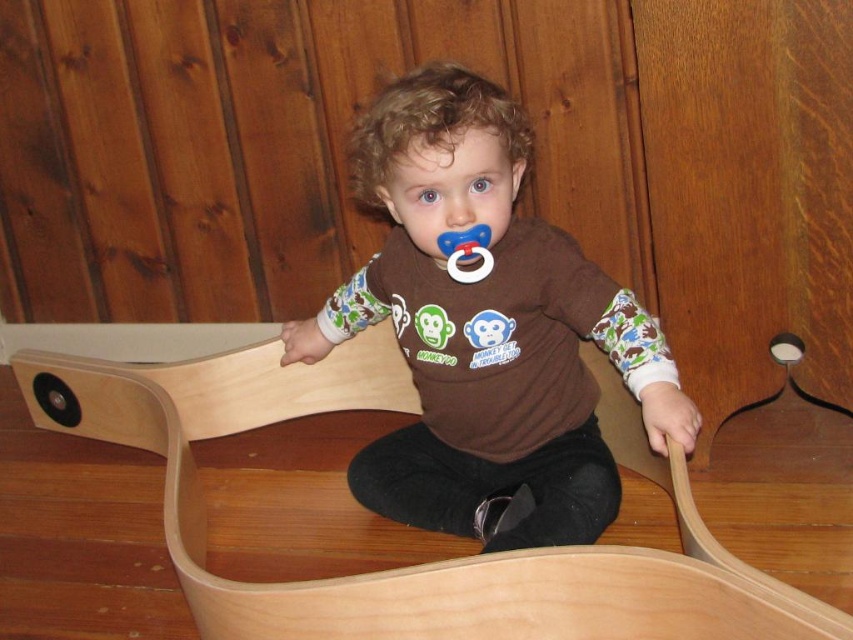
What are the coordinates of the brown matte shirt at center in the image?

The brown matte shirt at center is located at point (486, 332).

You are a photographer trying to capture a closeup of the boat. You need to focus on the point that is closer to you. Which point should you choose between point (555, 451) and point (456, 257)?

Point (555, 451) is further to the viewer than point (456, 257), so you should focus on point (456, 257) as it is closer to you.

You are standing in front of the boat and want to place a small flag at point (625, 353). If your hand can reach up to 1 meter, can you reach that point?

The point (625, 353) is 1.08 meters from the camera, so your hand can not reach it since it is slightly further than 1 meter.